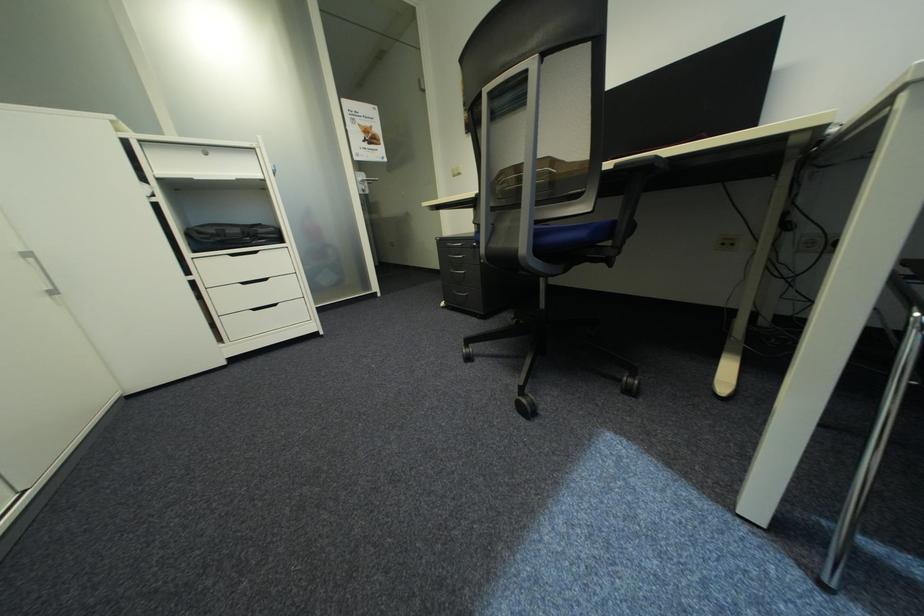
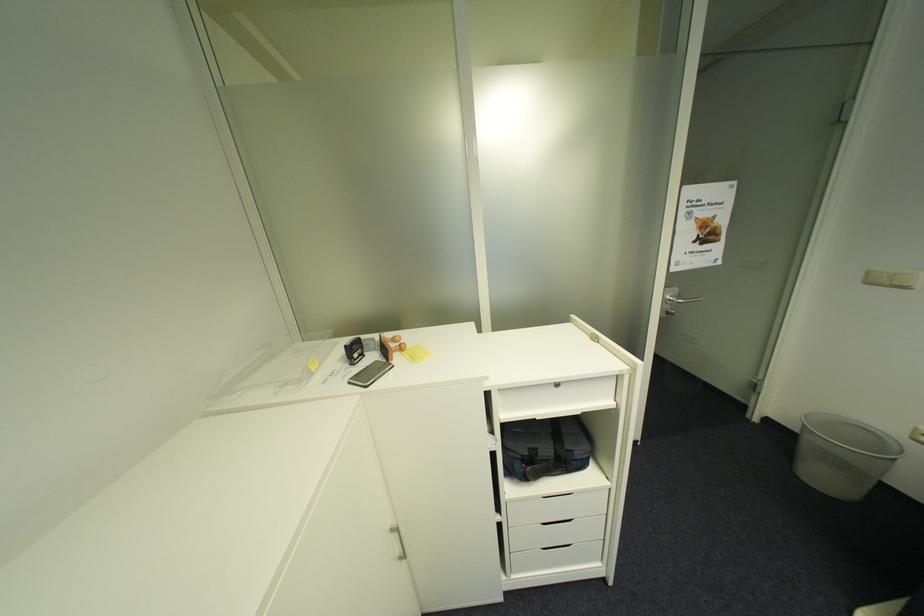
Where in the second image is the point corresponding to the point at 462,177 from the first image?

(876, 284)